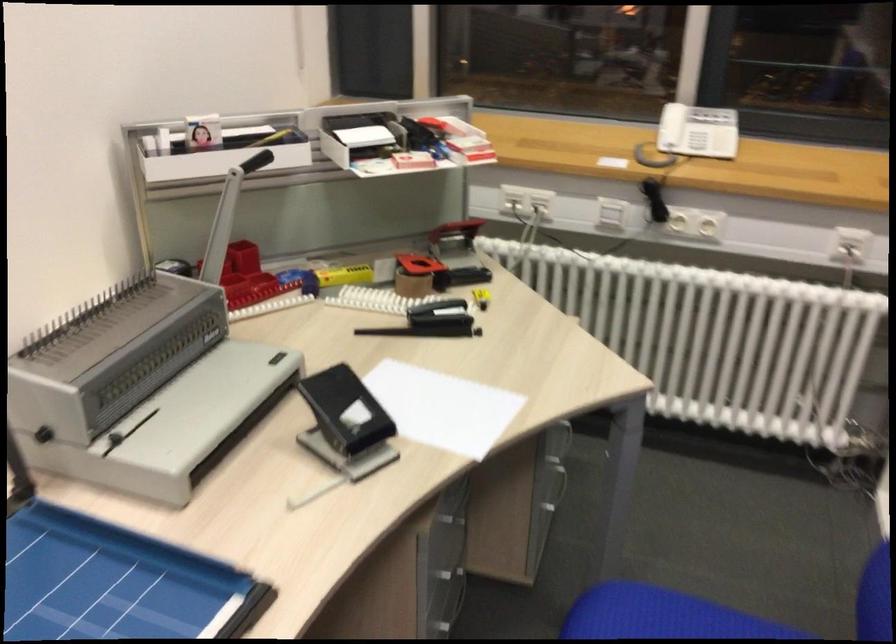
What do you see at coordinates (228, 216) in the screenshot?
I see `a binding machine lever` at bounding box center [228, 216].